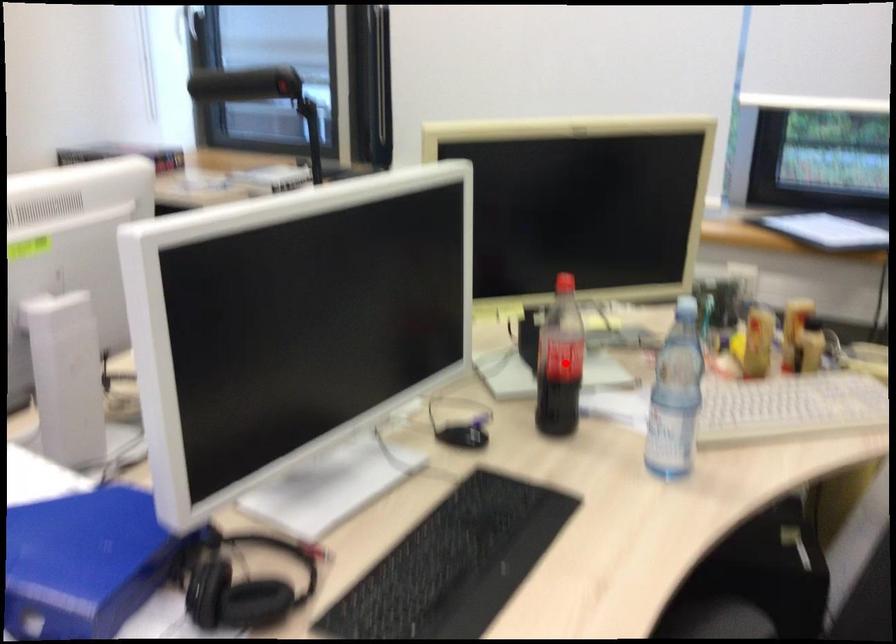
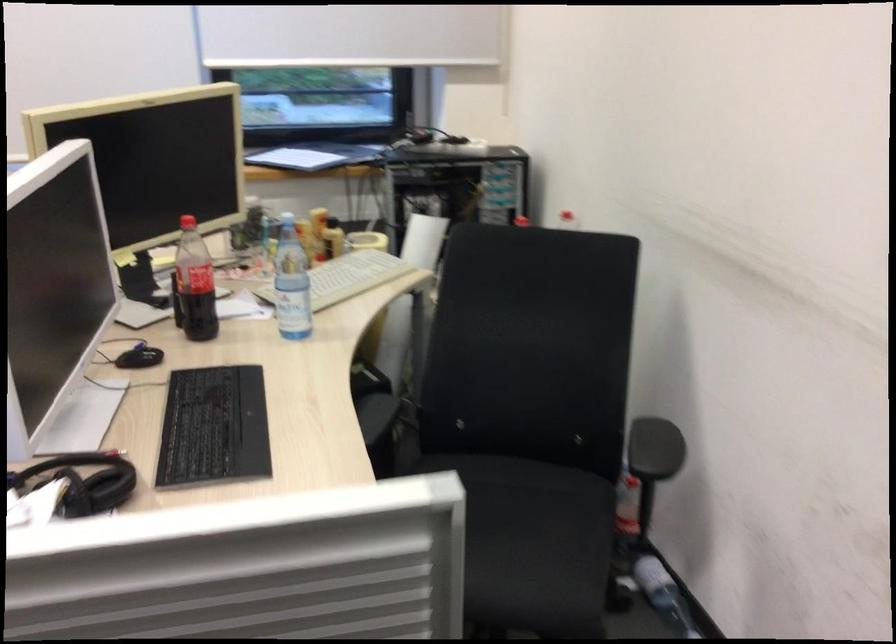
Locate, in the second image, the point that corresponds to the highlighted location in the first image.

(194, 283)